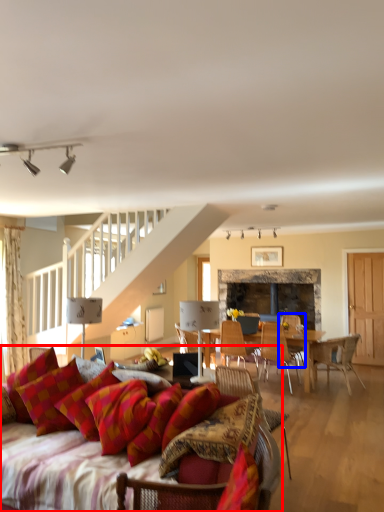
Question: Which object appears farthest to the camera in this image, studio couch (highlighted by a red box) or chair (highlighted by a blue box)?

Choices:
 (A) studio couch
 (B) chair

Answer: (B)